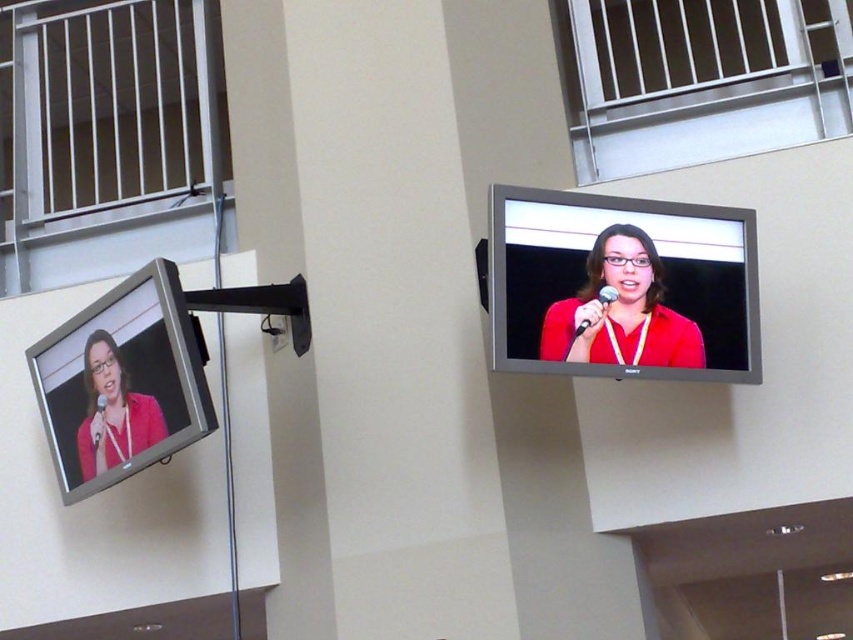
You are standing in front of the wall with two televisions. The matte black monitor at upper right is important for your presentation. Can you tell me which television is positioned higher on the wall?

The matte black monitor at upper right is located at point (622, 285), which indicates it is positioned higher on the wall compared to the other television.

You are an event coordinator checking the setup for a presentation. You notice two screens in the image. Which object, the matte black monitor at left or the matte red shirt at upper right, is larger in size?

The matte black monitor at left is bigger than the matte red shirt at upper right according to the description.